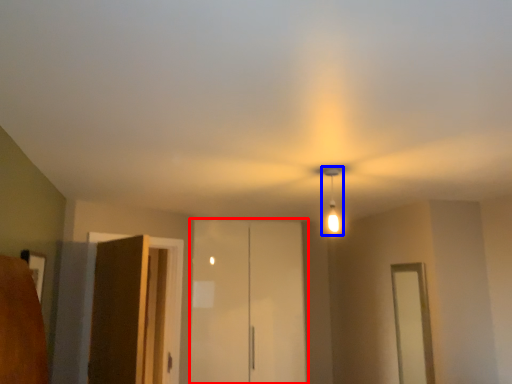
Question: Among these objects, which one is nearest to the camera, elevator (highlighted by a red box) or light fixture (highlighted by a blue box)?

Choices:
 (A) elevator
 (B) light fixture

Answer: (B)